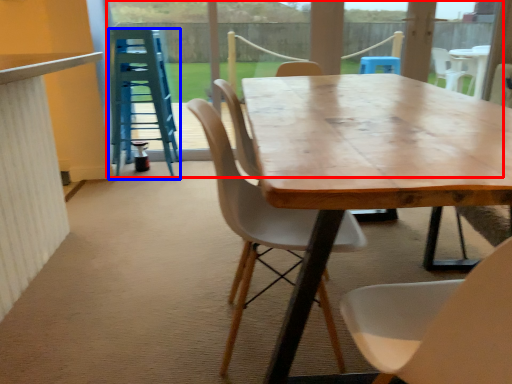
Question: Which object is closer to the camera taking this photo, glass door (highlighted by a red box) or stool (highlighted by a blue box)?

Choices:
 (A) glass door
 (B) stool

Answer: (B)